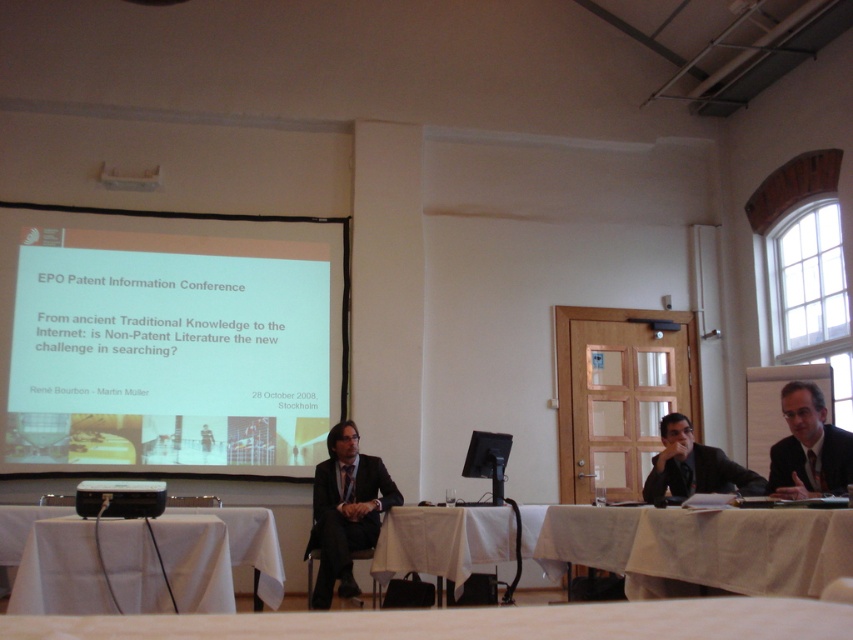
Consider the image. Is white cloth-covered table at lower left thinner than black plastic projector at lower left?

Incorrect, white cloth-covered table at lower left's width is not less than black plastic projector at lower left's.

Between point (235, 541) and point (151, 481), which one is positioned in front?

Point (235, 541)

Which is in front, point (254, 529) or point (135, 499)?

Point (135, 499)

Identify the location of white cloth-covered table at lower left. This screenshot has height=640, width=853. (252, 545).

Between point (440, 518) and point (259, 570), which one is positioned behind?

Point (440, 518)

Does point (389, 525) come farther from viewer compared to point (254, 529)?

Yes.

Locate an element on the screen. white fabric table at center is located at coordinates (442, 541).

Is white fabric table at lower center shorter than black matte suit at center?

Yes.

Based on the photo, can you confirm if white fabric table at lower center is positioned to the left of black matte suit at center?

Correct, you'll find white fabric table at lower center to the left of black matte suit at center.

Locate an element on the screen. This screenshot has width=853, height=640. white fabric table at lower center is located at coordinates (474, 621).